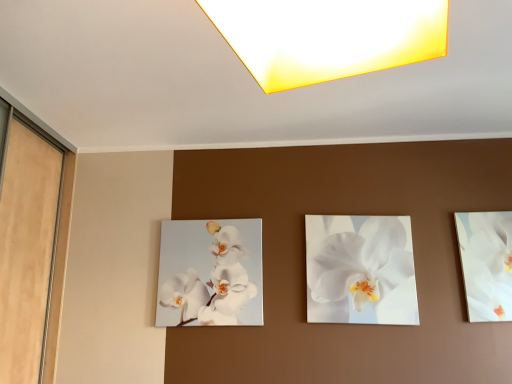
Question: Would you say white glossy orchid at right is inside or outside matte yellow square at upper center?

Choices:
 (A) inside
 (B) outside

Answer: (B)

Question: In terms of size, does white glossy orchid at right appear bigger or smaller than matte yellow square at upper center?

Choices:
 (A) small
 (B) big

Answer: (A)

Question: Which of these objects is positioned farthest from the white glossy orchid at center, the first flower when ordered from left to right?

Choices:
 (A) white glossy orchid at right
 (B) matte yellow square at upper center
 (C) white glossy orchid at center, the second flower from the left

Answer: (B)

Question: Estimate the real-world distances between objects in this image. Which object is closer to the white glossy orchid at center, which is counted as the second flower, starting from the right?

Choices:
 (A) white glossy orchid at center, which is the 1th flower in right-to-left order
 (B) matte yellow square at upper center
 (C) white glossy orchid at right

Answer: (A)